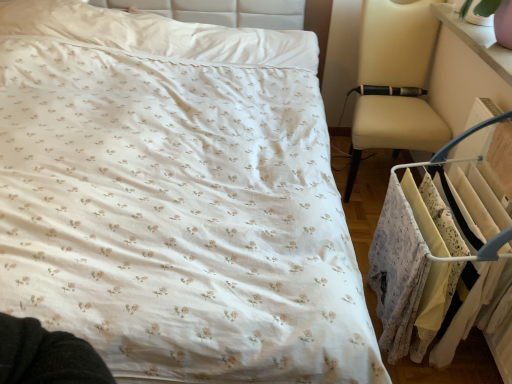
Question: Would you say white fabric clothes at right is to the left or to the right of pink glossy changing table at upper right in the picture?

Choices:
 (A) right
 (B) left

Answer: (B)

Question: In terms of width, does white fabric clothes at right look wider or thinner when compared to pink glossy changing table at upper right?

Choices:
 (A) thin
 (B) wide

Answer: (B)

Question: Based on their sizes in the image, would you say white fabric clothes at right is bigger or smaller than pink glossy changing table at upper right?

Choices:
 (A) small
 (B) big

Answer: (B)

Question: In the image, is pink glossy changing table at upper right on the left side or the right side of white fabric clothes at right?

Choices:
 (A) left
 (B) right

Answer: (B)

Question: From the image's perspective, relative to white fabric clothes at right, is pink glossy changing table at upper right above or below?

Choices:
 (A) above
 (B) below

Answer: (A)

Question: Based on their sizes in the image, would you say pink glossy changing table at upper right is bigger or smaller than white fabric clothes at right?

Choices:
 (A) small
 (B) big

Answer: (A)

Question: Is pink glossy changing table at upper right inside or outside of white fabric clothes at right?

Choices:
 (A) inside
 (B) outside

Answer: (B)